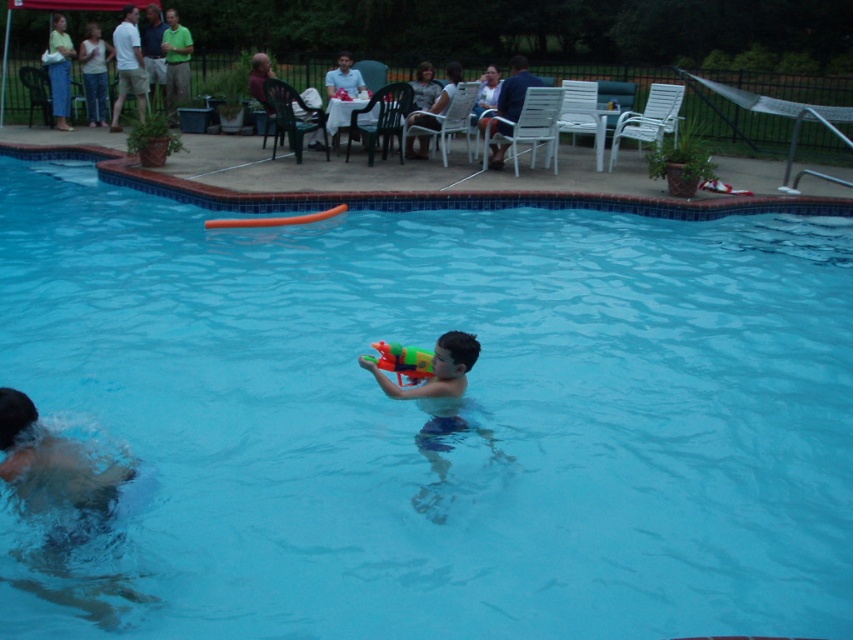
Question: Can you confirm if gray fabric shirt at upper center is positioned to the right of smooth white shirt at upper center?

Choices:
 (A) no
 (B) yes

Answer: (B)

Question: Which point is closer to the camera?

Choices:
 (A) light green cotton shirt at upper left
 (B) green matte shirt at upper center
 (C) blue denim shorts at center

Answer: (C)

Question: Which object is the farthest from the green matte shirt at upper center?

Choices:
 (A) denim jeans at upper left
 (B) blue denim shorts at center
 (C) smooth white shirt at upper center
 (D) light green cotton shirt at upper left

Answer: (B)

Question: Which point appears farthest from the camera in this image?

Choices:
 (A) (134, 33)
 (B) (177, 72)

Answer: (B)

Question: Can you confirm if denim jeans at upper left is thinner than smooth white shirt at upper center?

Choices:
 (A) no
 (B) yes

Answer: (B)

Question: Can you confirm if blue denim shorts at center is positioned above denim jeans at upper left?

Choices:
 (A) yes
 (B) no

Answer: (B)